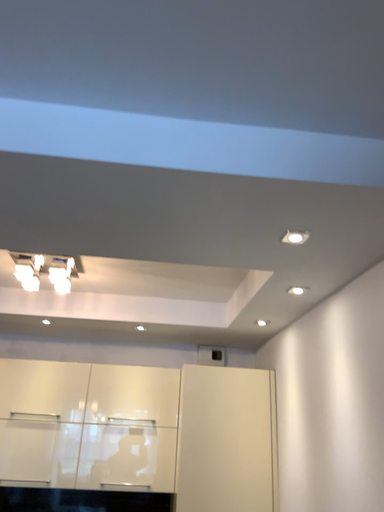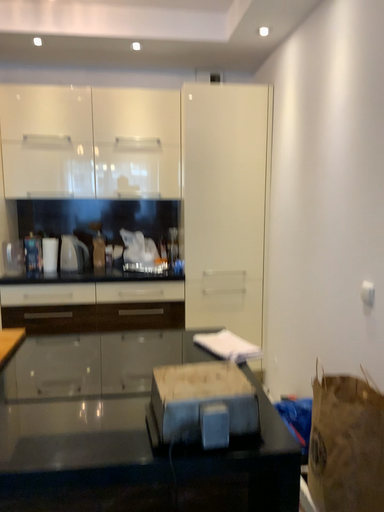
Question: Which way did the camera rotate in the video?

Choices:
 (A) rotated downward
 (B) rotated upward

Answer: (A)